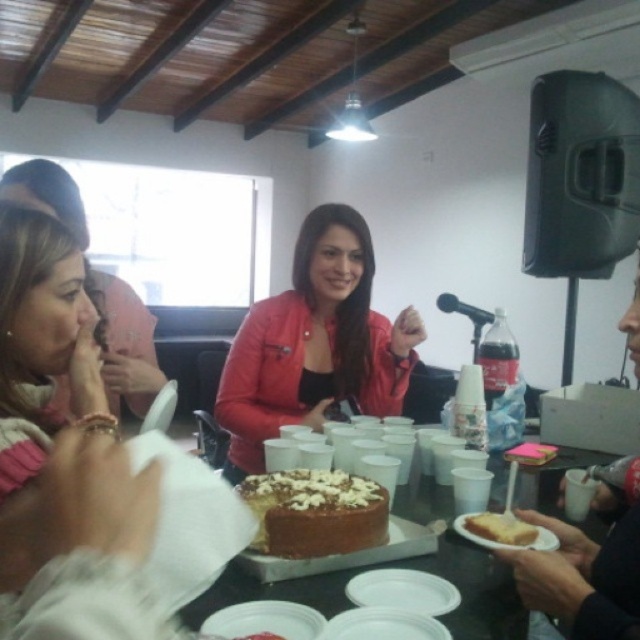
Question: Observing the image, what is the correct spatial positioning of chocolate cake at center in reference to yellow sponge cake at lower center?

Choices:
 (A) right
 (B) left

Answer: (B)

Question: Estimate the real-world distances between objects in this image. Which object is farther from the matte red jacket at center?

Choices:
 (A) matte pink scarf at left
 (B) chocolate frosted cake at center

Answer: (A)

Question: Does yellow sponge cake at lower center lie behind black plastic microphone at upper right?

Choices:
 (A) no
 (B) yes

Answer: (A)

Question: Which point is farther to the camera?

Choices:
 (A) (461, 312)
 (B) (362, 264)
 (C) (29, 237)
 (D) (323, 528)

Answer: (A)

Question: In this image, where is matte red jacket at center located relative to yellow sponge cake at lower center?

Choices:
 (A) left
 (B) right

Answer: (A)

Question: Which point is closer to the camera taking this photo?

Choices:
 (A) (481, 529)
 (B) (397, 352)
 (C) (36, 275)
 (D) (445, 292)

Answer: (C)